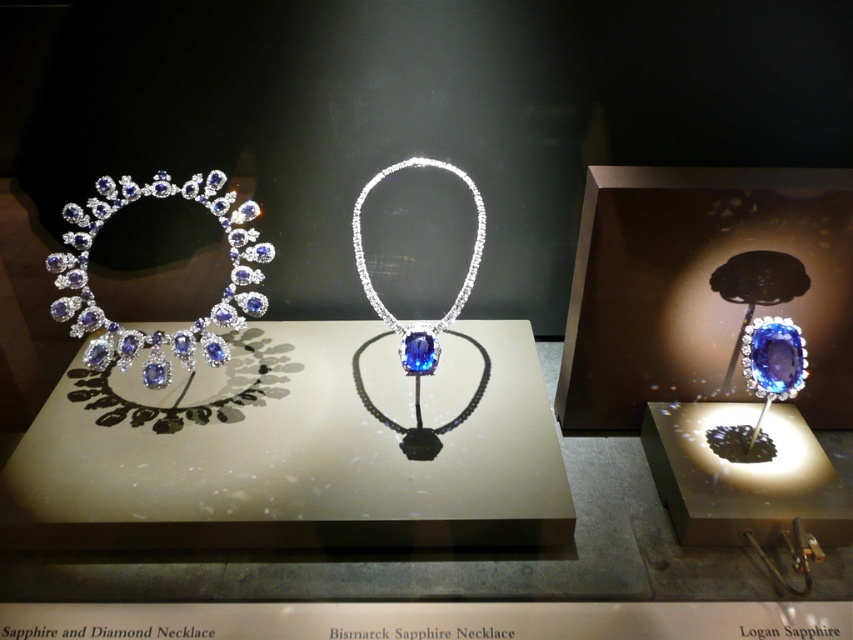
You are a jeweler who needs to determine which piece of jewelry is larger between the sapphire and diamond tiara at left and the blue gemstone necklace at center. Based on the image, which one is bigger?

The sapphire and diamond tiara at left is larger in size compared to the blue gemstone necklace at center according to the description.

Based on the photo, you are a jeweler assessing the dimensions of the jewelry pieces. Which of the two items, the sapphire and diamond tiara at left or the blue gemstone necklace at center, has a greater length?

The blue gemstone necklace at center is longer than the sapphire and diamond tiara at left, so the blue gemstone necklace at center has a greater length.